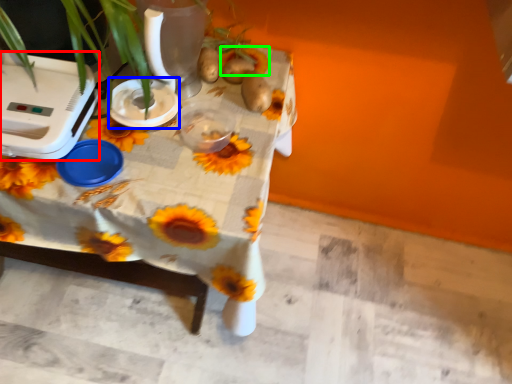
Question: Which is nearer to the appliance (highlighted by a red box)? appliance (highlighted by a blue box) or flower (highlighted by a green box).

Choices:
 (A) appliance
 (B) flower

Answer: (A)